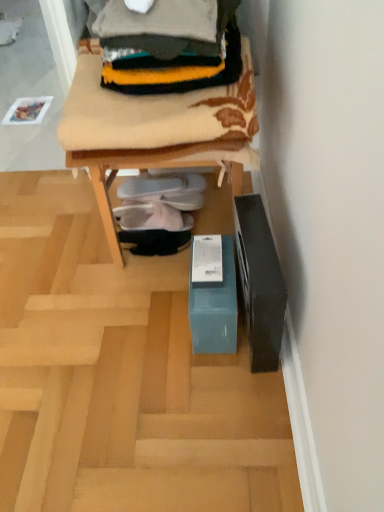
Question: Is white fabric shoe at center, arranged as the second footwear when ordered from the bottom, closer to the viewer compared to teal cardboard box at lower center?

Choices:
 (A) no
 (B) yes

Answer: (A)

Question: Is white fabric shoe at center, the second footwear from the top, taller than teal cardboard box at lower center?

Choices:
 (A) yes
 (B) no

Answer: (A)

Question: Is white fabric shoe at center, the second footwear from the top, wider than teal cardboard box at lower center?

Choices:
 (A) no
 (B) yes

Answer: (A)

Question: Can we say white fabric shoe at center, arranged as the second footwear when ordered from the bottom, lies outside teal cardboard box at lower center?

Choices:
 (A) yes
 (B) no

Answer: (A)

Question: From a real-world perspective, does white fabric shoe at center, the second footwear from the top, sit lower than teal cardboard box at lower center?

Choices:
 (A) yes
 (B) no

Answer: (B)

Question: From the image's perspective, is white fabric shoe at center, the second footwear from the top, positioned above or below teal cardboard box at lower center?

Choices:
 (A) below
 (B) above

Answer: (B)

Question: Is white fabric shoe at center, the second footwear from the top, taller or shorter than teal cardboard box at lower center?

Choices:
 (A) tall
 (B) short

Answer: (A)

Question: Is white fabric shoe at center, the second footwear from the top, in front of or behind teal cardboard box at lower center in the image?

Choices:
 (A) behind
 (B) front

Answer: (A)

Question: From a real-world perspective, is white fabric shoe at center, the second footwear from the top, above or below teal cardboard box at lower center?

Choices:
 (A) below
 (B) above

Answer: (B)

Question: Visually, is white fabric slipper at center, which is the third footwear in bottom-to-top order, positioned to the left or to the right of teal cardboard box at lower center?

Choices:
 (A) left
 (B) right

Answer: (B)

Question: From the image's perspective, is white fabric slipper at center, which is the third footwear in bottom-to-top order, above or below teal cardboard box at lower center?

Choices:
 (A) below
 (B) above

Answer: (B)

Question: Looking at the image, does white fabric slipper at center, which is the first footwear from top to bottom, seem bigger or smaller compared to teal cardboard box at lower center?

Choices:
 (A) big
 (B) small

Answer: (B)

Question: Looking at their shapes, would you say white fabric slipper at center, which is the first footwear from top to bottom, is wider or thinner than teal cardboard box at lower center?

Choices:
 (A) thin
 (B) wide

Answer: (A)

Question: Looking at their shapes, would you say knitted wool sweater at upper center is wider or thinner than teal cardboard box at lower center?

Choices:
 (A) wide
 (B) thin

Answer: (B)

Question: Visually, is knitted wool sweater at upper center positioned to the left or to the right of teal cardboard box at lower center?

Choices:
 (A) left
 (B) right

Answer: (B)